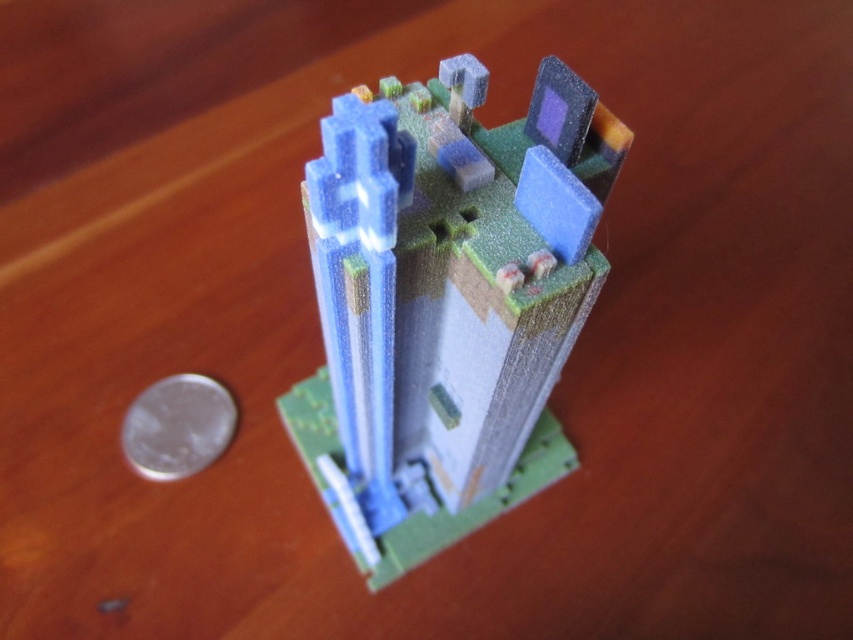
Question: Is translucent plastic building at center positioned at the back of silver metallic coin at lower left?

Choices:
 (A) yes
 (B) no

Answer: (B)

Question: Which point is farther from the camera taking this photo?

Choices:
 (A) (409, 410)
 (B) (178, 467)

Answer: (B)

Question: Which object is closer to the camera taking this photo?

Choices:
 (A) silver metallic coin at lower left
 (B) translucent plastic building at center

Answer: (B)

Question: Is translucent plastic building at center positioned behind silver metallic coin at lower left?

Choices:
 (A) yes
 (B) no

Answer: (B)

Question: Which point is farther to the camera?

Choices:
 (A) translucent plastic building at center
 (B) silver metallic coin at lower left

Answer: (B)

Question: Considering the relative positions of translucent plastic building at center and silver metallic coin at lower left in the image provided, where is translucent plastic building at center located with respect to silver metallic coin at lower left?

Choices:
 (A) above
 (B) below

Answer: (A)